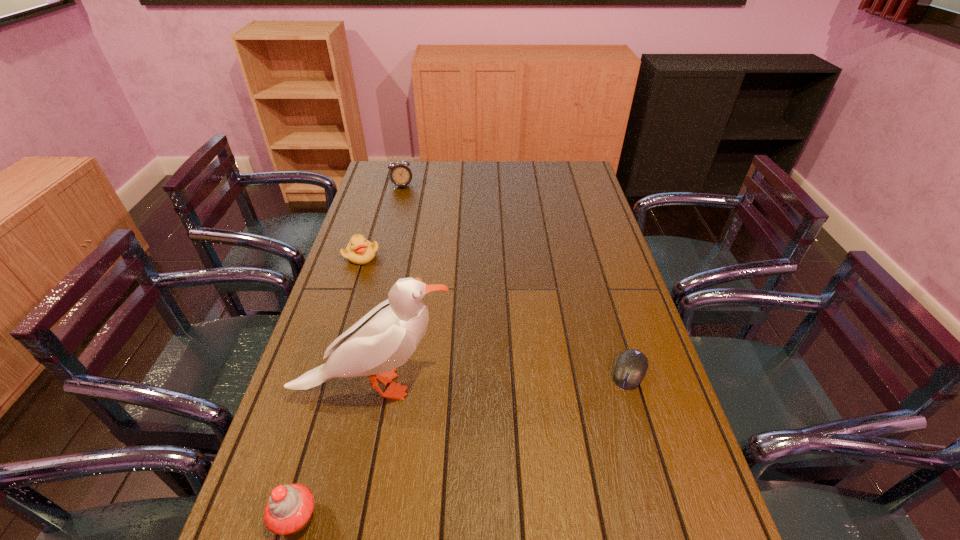
Image resolution: width=960 pixels, height=540 pixels. In order to click on free space located at the face of the fourth nearest object in this screenshot , I will do `click(433, 324)`.

Identify the location of free region located at the face of the fourth nearest object. (382, 274).

Find the location of a particular element. vacant region located at the face of the fourth nearest object is located at coordinates (382, 274).

Image resolution: width=960 pixels, height=540 pixels. I want to click on vacant space situated at the beak of the gull, so click(612, 422).

Where is `vacant space situated at the beak of the gull`? This screenshot has width=960, height=540. vacant space situated at the beak of the gull is located at coordinates (539, 407).

Find the location of a particular element. free space located at the beak of the gull is located at coordinates (551, 409).

Identify the location of object at the far edge. (400, 174).

Find the location of a particular element. alarm clock present at the left edge is located at coordinates (400, 174).

Find the location of a particular element. duckling that is positioned at the left edge is located at coordinates (360, 251).

I want to click on gull that is at the left edge, so click(x=385, y=338).